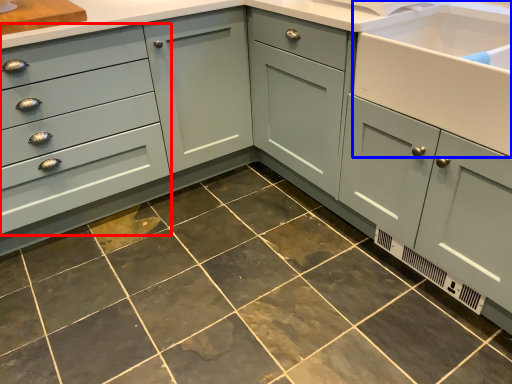
Question: Which point is closer to the camera, drawer (highlighted by a red box) or sink (highlighted by a blue box)?

Choices:
 (A) drawer
 (B) sink

Answer: (B)